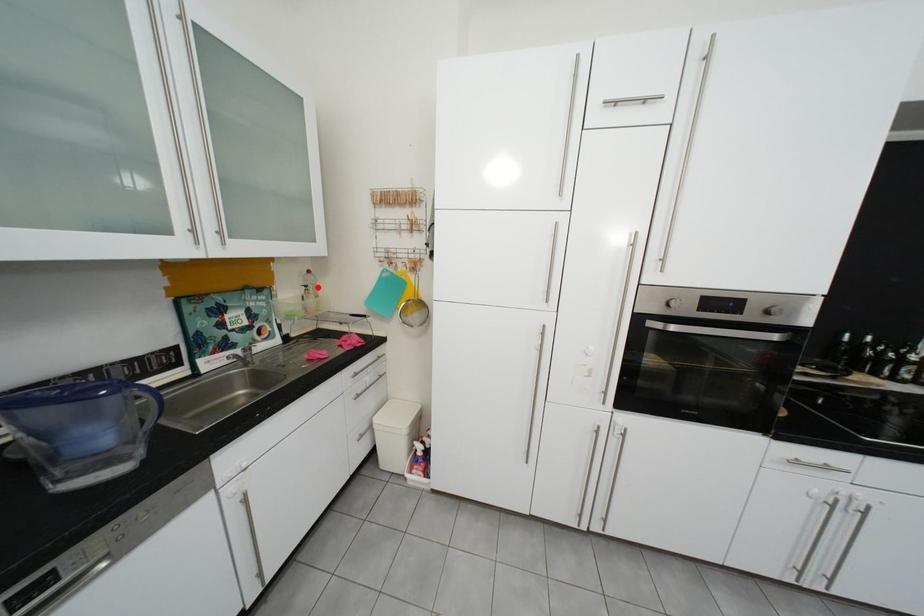
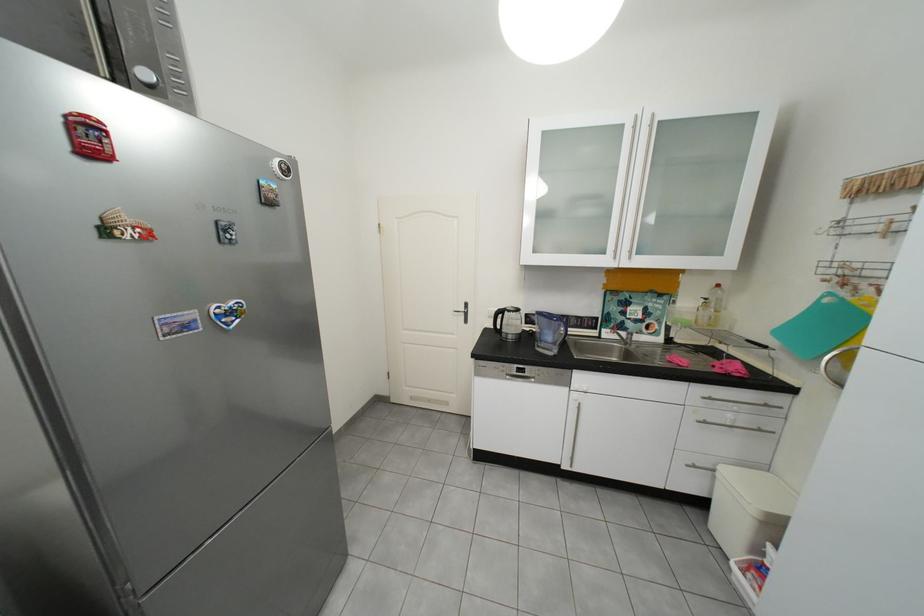
Where in the second image is the point corresponding to the highlighted location from the first image?

(718, 300)